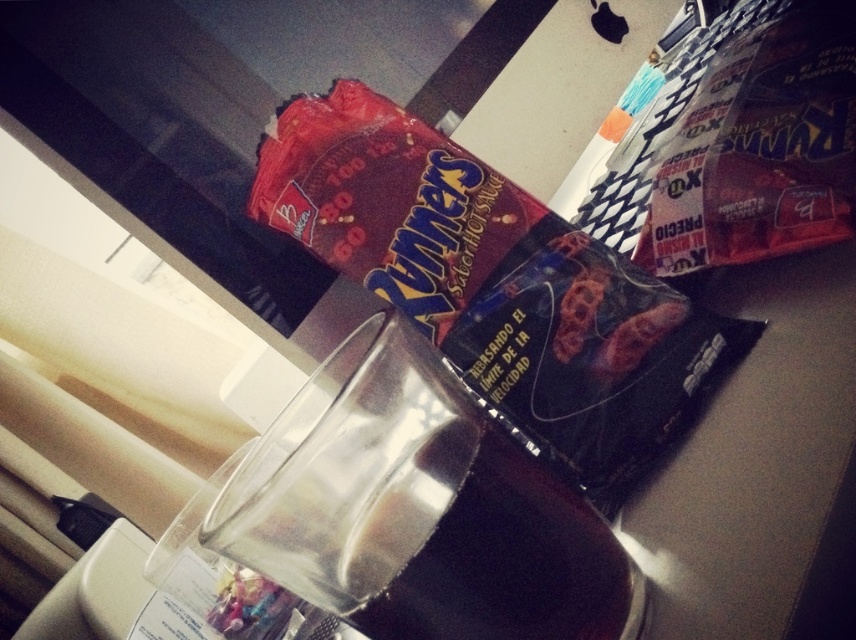
You are looking at the desk and want to place a small sticker exactly halfway between point (608, 296) and point (593, 625). Considering their positions, will the sticker be closer to the viewer or further away than both points?

The sticker placed halfway between point (608, 296) and point (593, 625) will be closer to the viewer than point (593, 625) but further away than point (608, 296) since it is halfway between them. However, since point (608, 296) is closer to the viewer, the midpoint will still be closer to the viewer than point (593, 625) but not as close as point (608, 296). Therefore, the sticker will be between both points in terms of depth.

You are organizing items on a desk and need to place the matte plastic bag of ruffles at upper center and the clear glass beverage at center in a drawer. The drawer has limited height. Which item might not fit if the drawer is only tall enough for the shorter object?

The matte plastic bag of ruffles at upper center is much taller than the clear glass beverage at center, so it might not fit in the drawer if the drawer is only tall enough for the shorter object.

What are the coordinates of the matte plastic bag of ruffles at upper center?

Answer: The coordinates of the matte plastic bag of ruffles at upper center are (494, 282).